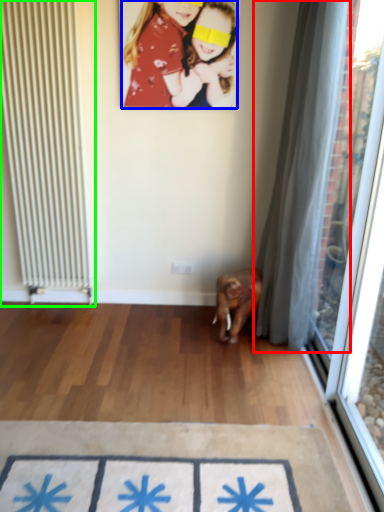
Question: Estimate the real-world distances between objects in this image. Which object is farther from curtain (highlighted by a red box), person (highlighted by a blue box) or radiator (highlighted by a green box)?

Choices:
 (A) person
 (B) radiator

Answer: (B)